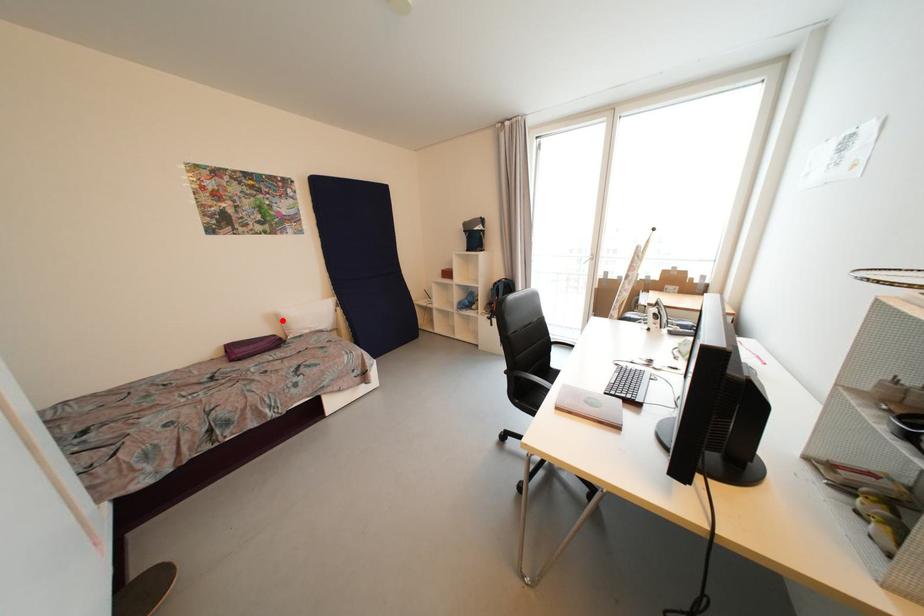
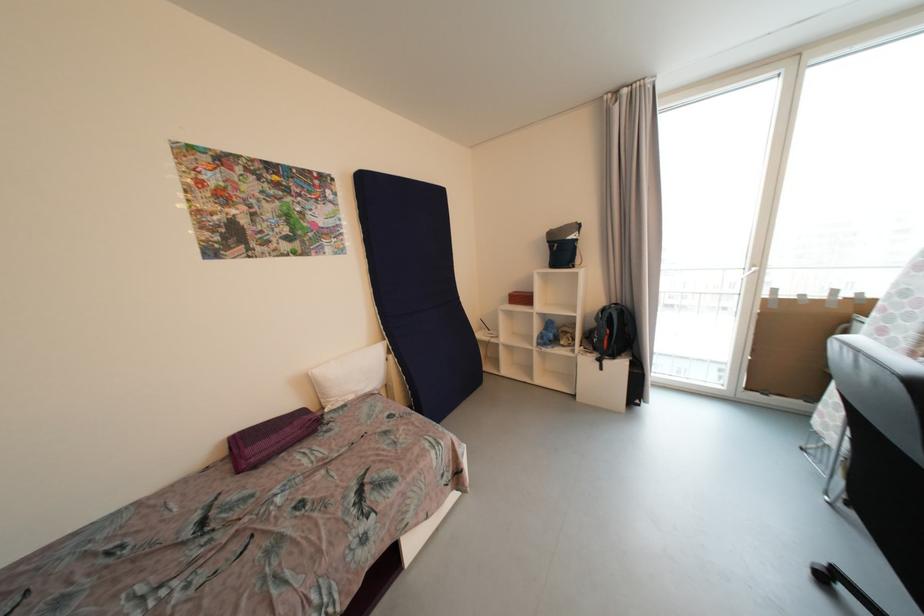
Where in the second image is the point corresponding to the highlighted location from the first image?

(315, 386)